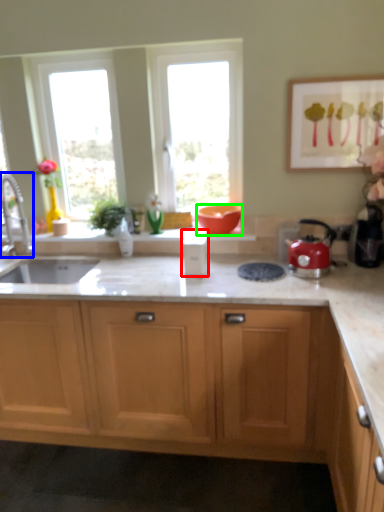
Question: Considering the real-world distances, which object is farthest from appliance (highlighted by a red box)? tap (highlighted by a blue box) or flowerpot (highlighted by a green box)?

Choices:
 (A) tap
 (B) flowerpot

Answer: (A)